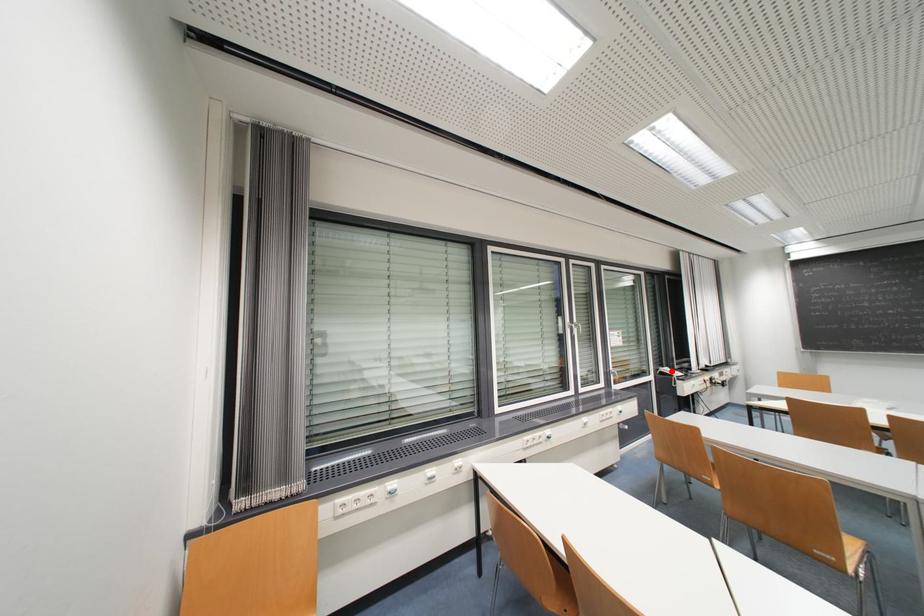
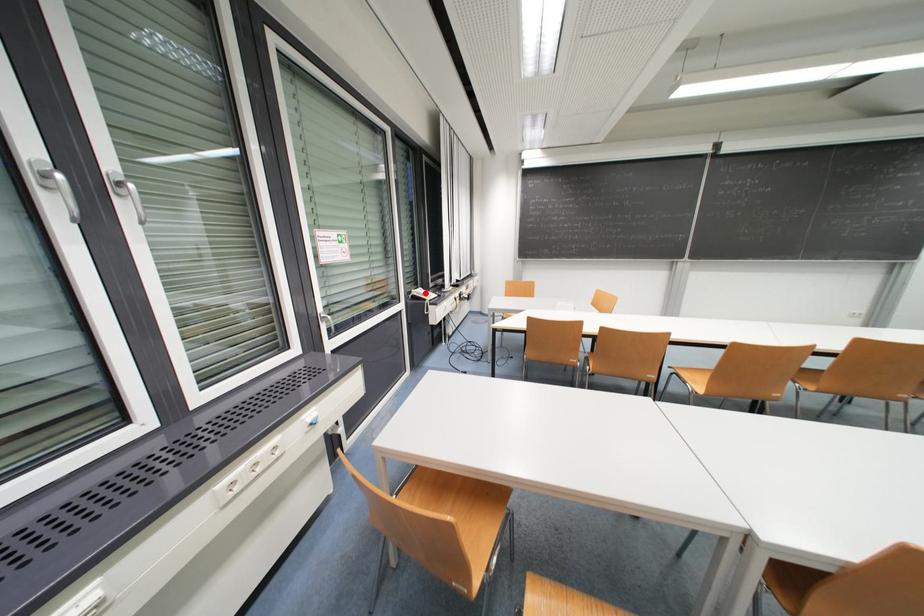
I am providing you with two images of the same scene from different viewpoints. A red point is marked on the first image and another point is marked on the second image. Is the marked point in image1 the same physical position as the marked point in image2?

Yes